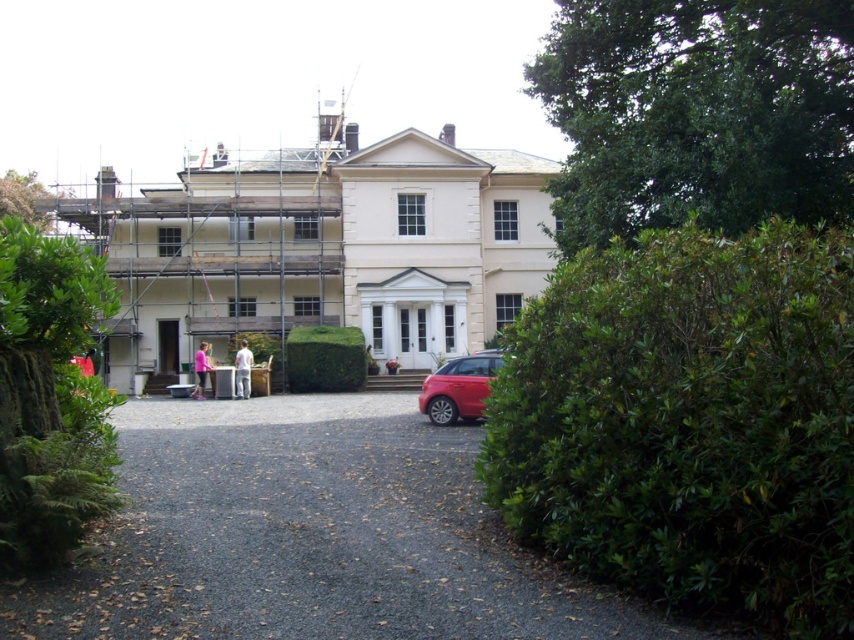
Question: Which point is farther to the camera?

Choices:
 (A) white smooth mansion at center
 (B) green leafy hedge at center

Answer: (B)

Question: Can you confirm if green leafy hedge at right is wider than shiny red hatchback at center?

Choices:
 (A) no
 (B) yes

Answer: (B)

Question: Among these objects, which one is farthest from the camera?

Choices:
 (A) green leafy bush at left
 (B) pink fabric person at center
 (C) green leafy hedge at right

Answer: (B)

Question: Estimate the real-world distances between objects in this image. Which object is closer to the green leafy bush at upper right?

Choices:
 (A) gray gravel driveway at center
 (B) green leafy hedge at center

Answer: (A)

Question: Is gray gravel driveway at center above white cotton shirt at center?

Choices:
 (A) no
 (B) yes

Answer: (A)

Question: Is green leafy hedge at center above white cotton shirt at center?

Choices:
 (A) no
 (B) yes

Answer: (B)